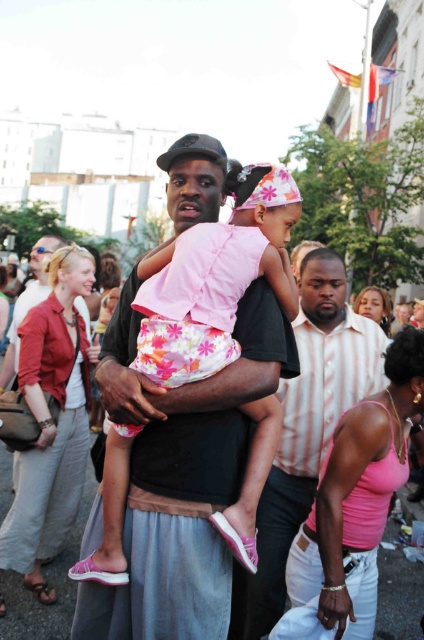
Question: Does floral fabric dress at center appear over pink fabric dress at center?

Choices:
 (A) yes
 (B) no

Answer: (B)

Question: Can you confirm if floral fabric dress at center is positioned to the left of pink fabric tank top at center?

Choices:
 (A) no
 (B) yes

Answer: (B)

Question: Which of these objects is positioned closest to the matte black shirt at center?

Choices:
 (A) pink fabric tank top at center
 (B) pink fabric dress at center

Answer: (A)

Question: Which object is positioned closest to the pink fabric dress at center?

Choices:
 (A) floral fabric dress at center
 (B) pink fabric tank top at center
 (C) matte red blouse at center
 (D) matte black shirt at center

Answer: (D)

Question: Which of the following is the closest to the observer?

Choices:
 (A) matte red blouse at center
 (B) floral fabric dress at center
 (C) pink fabric dress at center

Answer: (B)

Question: Does floral fabric dress at center have a smaller size compared to pink fabric dress at center?

Choices:
 (A) yes
 (B) no

Answer: (B)